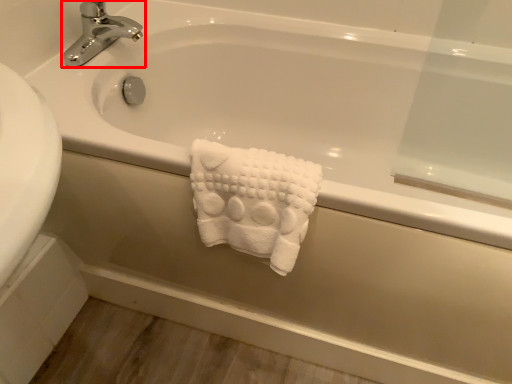
Question: From the image's perspective, where is tap (annotated by the red box) located in relation to towel in the image?

Choices:
 (A) below
 (B) above

Answer: (B)